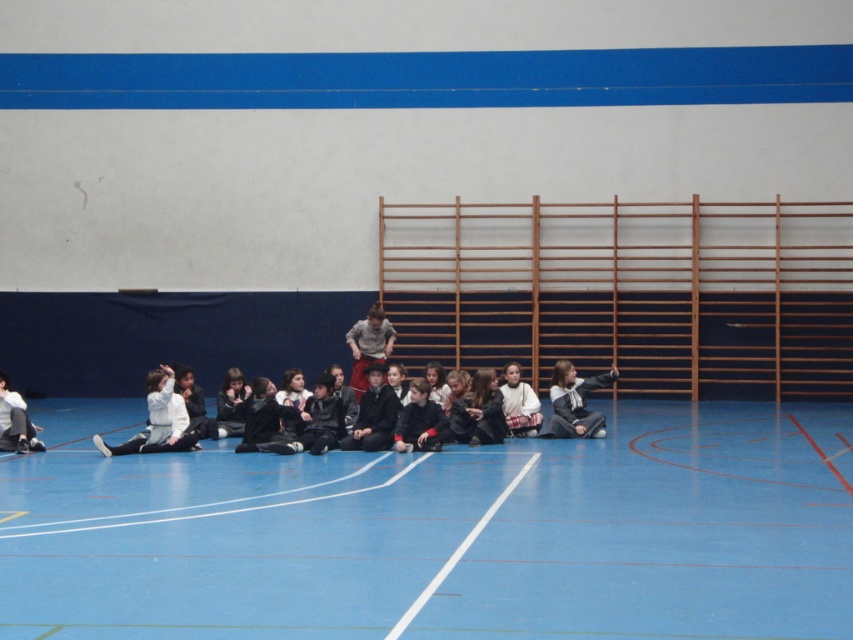
Question: Which object is positioned farthest from the blue rubber basketball court at lower center?

Choices:
 (A) white matte jacket at lower left
 (B) dark gray sweater at lower left
 (C) black fabric jacket at lower right

Answer: (B)

Question: Among these points, which one is farthest from the camera?

Choices:
 (A) (183, 445)
 (B) (367, 340)
 (C) (281, 625)
 (D) (4, 419)

Answer: (B)

Question: Is blue rubber basketball court at lower center above dark gray sweater at lower left?

Choices:
 (A) yes
 (B) no

Answer: (B)

Question: Which point appears closest to the camera in this image?

Choices:
 (A) (589, 419)
 (B) (357, 380)

Answer: (A)

Question: Is white matte jacket at lower left above gray fabric shirt at center?

Choices:
 (A) no
 (B) yes

Answer: (A)

Question: Considering the relative positions of white matte jacket at lower left and black fabric jacket at lower right in the image provided, where is white matte jacket at lower left located with respect to black fabric jacket at lower right?

Choices:
 (A) left
 (B) right

Answer: (A)